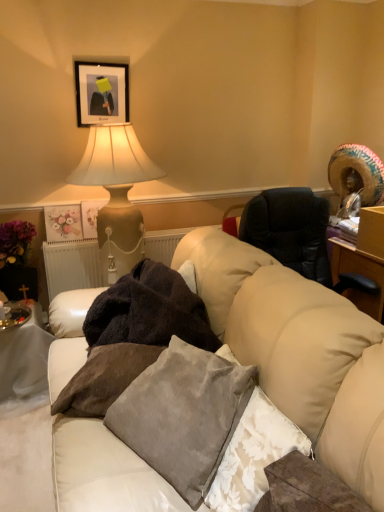
Find the location of `free space above velvet gray pillow at center, the 1th pillow from the right (from a real-world perspective)`. free space above velvet gray pillow at center, the 1th pillow from the right (from a real-world perspective) is located at coordinates (211, 372).